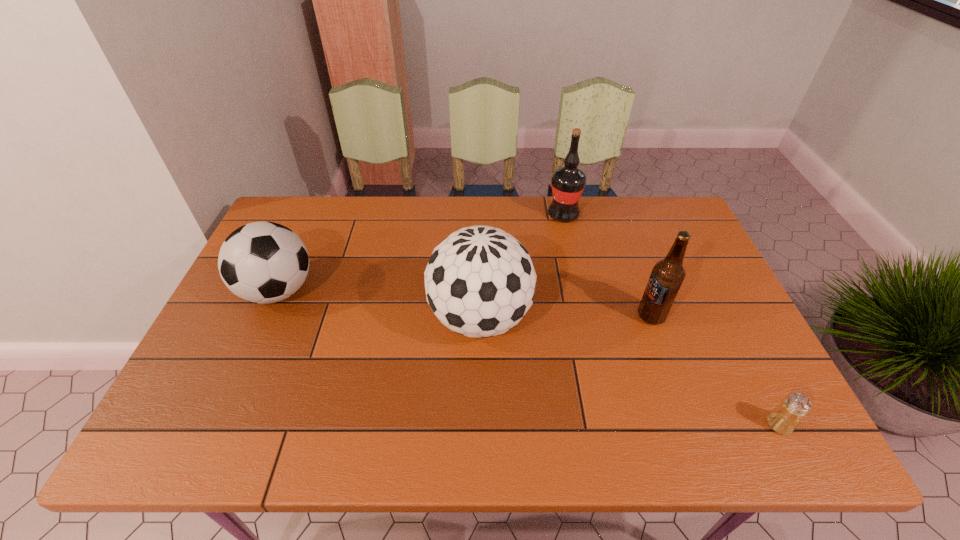
At what (x,y) coordinates should I click in order to perform the action: click on vacant point located 0.370m on the label of the beer bottle. Please return your answer as a coordinate pair (x, y). Image resolution: width=960 pixels, height=540 pixels. Looking at the image, I should click on tap(497, 316).

Locate an element on the screen. The image size is (960, 540). vacant space located 0.310m on the label of the beer bottle is located at coordinates (520, 316).

Locate an element on the screen. The height and width of the screenshot is (540, 960). vacant point located 0.310m on the label of the beer bottle is located at coordinates (520, 316).

Where is `vacant space located 0.050m on the front of the taller soccer ball`? The image size is (960, 540). vacant space located 0.050m on the front of the taller soccer ball is located at coordinates click(480, 379).

Locate an element on the screen. This screenshot has width=960, height=540. vacant space located 0.220m on the back of the leftmost object is located at coordinates (310, 219).

Identify the location of free region located on the left of the nearest object. (739, 424).

What are the coordinates of `object situated at the far edge` in the screenshot? It's located at (568, 182).

Where is `object that is positioned at the near edge`? object that is positioned at the near edge is located at coordinates (784, 419).

This screenshot has height=540, width=960. Identify the location of object that is positioned at the left edge. (262, 262).

Where is `object located at the right edge`? This screenshot has height=540, width=960. object located at the right edge is located at coordinates click(784, 419).